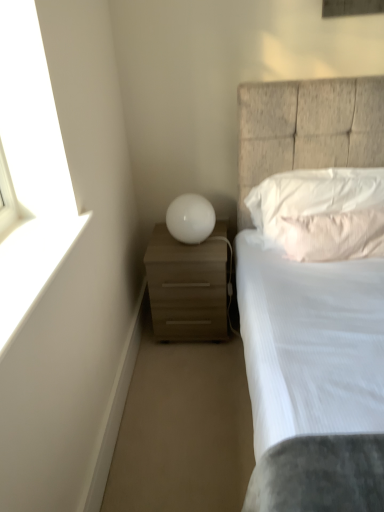
Question: Is white matte window sill at upper left shorter than white soft pillow at upper right, the 2th pillow ordered from the bottom?

Choices:
 (A) no
 (B) yes

Answer: (B)

Question: Is white matte window sill at upper left bigger than white soft pillow at upper right, the 2th pillow ordered from the bottom?

Choices:
 (A) yes
 (B) no

Answer: (B)

Question: Is white matte window sill at upper left completely or partially outside of white soft pillow at upper right, the 2th pillow ordered from the bottom?

Choices:
 (A) no
 (B) yes

Answer: (B)

Question: From a real-world perspective, is white matte window sill at upper left over white soft pillow at upper right, the 2th pillow ordered from the bottom?

Choices:
 (A) yes
 (B) no

Answer: (A)

Question: Is white matte window sill at upper left wider than white soft pillow at upper right, the 2th pillow ordered from the bottom?

Choices:
 (A) yes
 (B) no

Answer: (A)

Question: Visually, is white soft pillow at upper right, the 1th pillow when ordered from top to bottom, positioned to the left or to the right of pink textured pillow at upper right, which appears as the first pillow when ordered from the bottom?

Choices:
 (A) left
 (B) right

Answer: (A)

Question: From their relative heights in the image, would you say white soft pillow at upper right, the 1th pillow when ordered from top to bottom, is taller or shorter than pink textured pillow at upper right, which is the 2th pillow in top-to-bottom order?

Choices:
 (A) tall
 (B) short

Answer: (A)

Question: Is white soft pillow at upper right, the 2th pillow ordered from the bottom, bigger or smaller than pink textured pillow at upper right, which is the 2th pillow in top-to-bottom order?

Choices:
 (A) big
 (B) small

Answer: (A)

Question: Is point (327, 240) positioned closer to the camera than point (296, 238)?

Choices:
 (A) farther
 (B) closer

Answer: (B)

Question: Does point (324, 121) appear closer or farther from the camera than point (153, 326)?

Choices:
 (A) farther
 (B) closer

Answer: (B)

Question: Based on their sizes in the image, would you say white textured bed at center is bigger or smaller than matte wood nightstand at lower left?

Choices:
 (A) big
 (B) small

Answer: (A)

Question: Considering the positions of white textured bed at center and matte wood nightstand at lower left in the image, is white textured bed at center wider or thinner than matte wood nightstand at lower left?

Choices:
 (A) wide
 (B) thin

Answer: (A)

Question: Would you say white textured bed at center is to the left or to the right of matte wood nightstand at lower left in the picture?

Choices:
 (A) right
 (B) left

Answer: (A)

Question: From the image's perspective, relative to white soft pillow at upper right, the 2th pillow ordered from the bottom, is white matte window sill at upper left above or below?

Choices:
 (A) above
 (B) below

Answer: (B)

Question: Based on their sizes in the image, would you say white matte window sill at upper left is bigger or smaller than white soft pillow at upper right, the 2th pillow ordered from the bottom?

Choices:
 (A) big
 (B) small

Answer: (B)